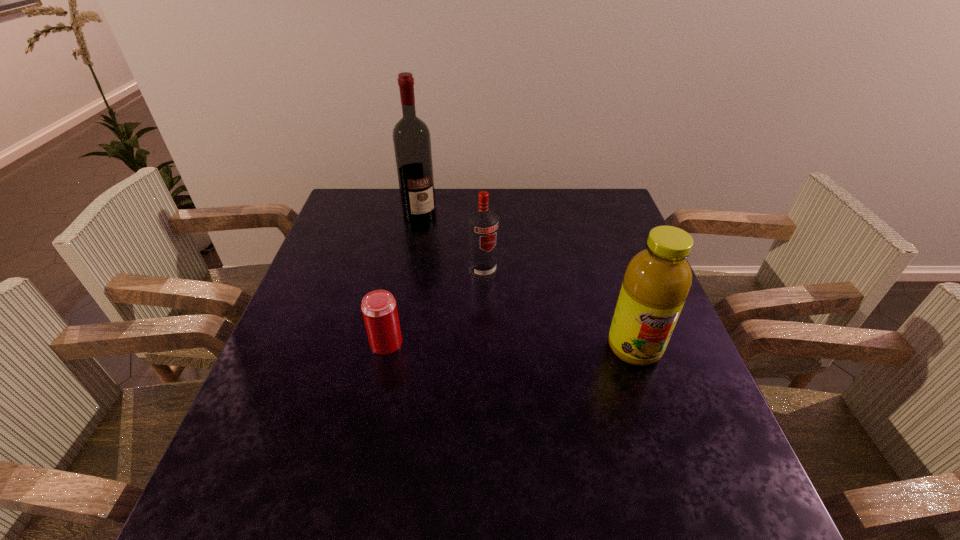
What are the coordinates of `vacant space at the right edge of the desktop` in the screenshot? It's located at (671, 336).

Where is `free space at the far left corner`? The width and height of the screenshot is (960, 540). free space at the far left corner is located at coordinates (366, 210).

Identify the location of free space at the near left corner of the desktop. (249, 431).

This screenshot has width=960, height=540. In order to click on free space at the far right corner of the desktop in this screenshot , I will do coord(580,188).

Identify the location of free area in between the rightmost object and the alcohol. (527, 281).

The image size is (960, 540). What are the coordinates of `vacant area that lies between the rightmost object and the alcohol` in the screenshot? It's located at (527, 281).

Where is `free space between the fruit juice and the vodka`? Image resolution: width=960 pixels, height=540 pixels. free space between the fruit juice and the vodka is located at coordinates (559, 310).

Where is `free spot between the tallest object and the second farthest object`? This screenshot has height=540, width=960. free spot between the tallest object and the second farthest object is located at coordinates (451, 244).

I want to click on vacant space that is in between the second tallest object and the shortest object, so click(511, 345).

Where is `empty location between the second object from right to left and the fruit juice`? empty location between the second object from right to left and the fruit juice is located at coordinates 559,310.